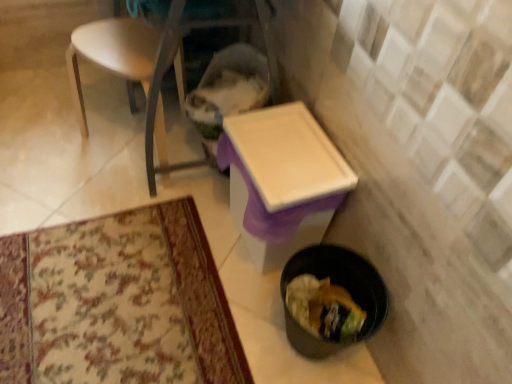
Question: From a real-world perspective, is white plastic table at center located beneath white plastic chair at upper left?

Choices:
 (A) yes
 (B) no

Answer: (A)

Question: Is white plastic table at center further to the viewer compared to white plastic chair at upper left?

Choices:
 (A) no
 (B) yes

Answer: (A)

Question: Considering the relative positions of white plastic table at center and white plastic chair at upper left in the image provided, is white plastic table at center in front of white plastic chair at upper left?

Choices:
 (A) yes
 (B) no

Answer: (A)

Question: From the image's perspective, would you say white plastic table at center is positioned over white plastic chair at upper left?

Choices:
 (A) yes
 (B) no

Answer: (B)

Question: From a real-world perspective, is white plastic table at center positioned over white plastic chair at upper left based on gravity?

Choices:
 (A) no
 (B) yes

Answer: (A)

Question: Is white plastic table at center at the left side of white plastic chair at upper left?

Choices:
 (A) no
 (B) yes

Answer: (A)

Question: Can you confirm if white plastic chair at upper left is thinner than black plastic trash can at lower right?

Choices:
 (A) yes
 (B) no

Answer: (B)

Question: From the image's perspective, is white plastic chair at upper left above black plastic trash can at lower right?

Choices:
 (A) no
 (B) yes

Answer: (B)

Question: Can you confirm if white plastic chair at upper left is taller than black plastic trash can at lower right?

Choices:
 (A) no
 (B) yes

Answer: (B)

Question: From a real-world perspective, is white plastic chair at upper left under black plastic trash can at lower right?

Choices:
 (A) no
 (B) yes

Answer: (A)

Question: Is white plastic chair at upper left facing towards black plastic trash can at lower right?

Choices:
 (A) yes
 (B) no

Answer: (B)

Question: Is white plastic chair at upper left placed right next to black plastic trash can at lower right?

Choices:
 (A) no
 (B) yes

Answer: (A)

Question: Considering the relative sizes of black plastic trash can at lower right and white plastic table at center in the image provided, is black plastic trash can at lower right bigger than white plastic table at center?

Choices:
 (A) no
 (B) yes

Answer: (A)